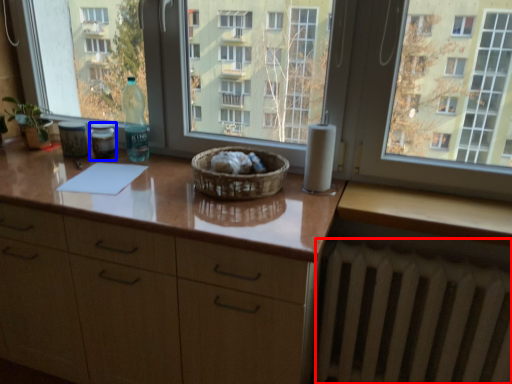
Question: Among these objects, which one is nearest to the camera, radiator (highlighted by a red box) or bottle (highlighted by a blue box)?

Choices:
 (A) radiator
 (B) bottle

Answer: (A)